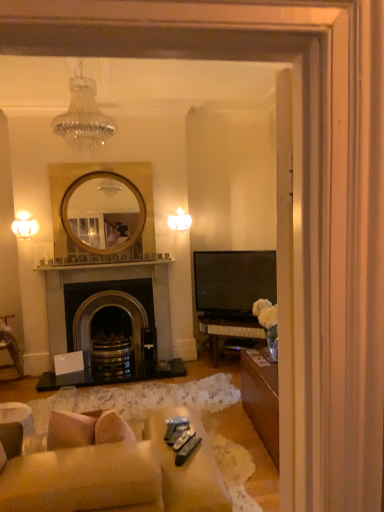
This screenshot has height=512, width=384. Describe the element at coordinates (83, 116) in the screenshot. I see `clear glass chandelier at upper center, acting as the 3th lamp starting from the back` at that location.

What are the coordinates of `metallic silver remote control at lower center, placed as the second remote control when sorted from front to back` in the screenshot? It's located at (183, 439).

The width and height of the screenshot is (384, 512). In order to click on dark gray stone fireplace at center in this screenshot , I will do `click(103, 307)`.

Find the location of a particular element. black plastic remote control at lower center, the 3th remote control from the front is located at coordinates (175, 432).

What is the approximate height of metallic gray remote control at lower center, the 3th remote control from the back?

metallic gray remote control at lower center, the 3th remote control from the back, is 3.31 centimeters in height.

What do you see at coordinates (187, 450) in the screenshot?
I see `metallic gray remote control at lower center, the 1th remote control viewed from the front` at bounding box center [187, 450].

At what (x,y) coordinates should I click in order to perform the action: click on clear glass chandelier at upper center, marked as the 2th lamp in a right-to-left arrangement. Please return your answer as a coordinate pair (x, y). This screenshot has height=512, width=384. Looking at the image, I should click on (83, 116).

Is metallic silver remote control at lower center, positioned as the second remote control in back-to-front order, situated inside black plastic remote control at lower center, which is counted as the first remote control, starting from the back, or outside?

metallic silver remote control at lower center, positioned as the second remote control in back-to-front order, is located beyond the bounds of black plastic remote control at lower center, which is counted as the first remote control, starting from the back.

Visually, is metallic silver remote control at lower center, positioned as the second remote control in back-to-front order, positioned to the left or to the right of black plastic remote control at lower center, the 3th remote control from the front?

In the image, metallic silver remote control at lower center, positioned as the second remote control in back-to-front order, appears on the right side of black plastic remote control at lower center, the 3th remote control from the front.

Is point (192, 433) positioned after point (174, 437)?

That is True.

Considering the relative sizes of clear glass chandelier at upper center, which is counted as the 2th lamp, starting from the left, and metallic gray remote control at lower center, the 1th remote control viewed from the front, in the image provided, is clear glass chandelier at upper center, which is counted as the 2th lamp, starting from the left, thinner than metallic gray remote control at lower center, the 1th remote control viewed from the front,?

No, clear glass chandelier at upper center, which is counted as the 2th lamp, starting from the left, is not thinner than metallic gray remote control at lower center, the 1th remote control viewed from the front.

How far apart are clear glass chandelier at upper center, the first lamp in the top-to-bottom sequence, and metallic gray remote control at lower center, the 1th remote control viewed from the front?

They are 1.96 meters apart.

Considering the sizes of objects clear glass chandelier at upper center, the third lamp ordered from the bottom, and metallic gray remote control at lower center, the 1th remote control viewed from the front, in the image provided, who is taller, clear glass chandelier at upper center, the third lamp ordered from the bottom, or metallic gray remote control at lower center, the 1th remote control viewed from the front,?

With more height is clear glass chandelier at upper center, the third lamp ordered from the bottom.

Which object is positioned more to the left, clear glass chandelier at upper center, which is counted as the 2th lamp, starting from the left, or metallic gray remote control at lower center, the 1th remote control viewed from the front?

clear glass chandelier at upper center, which is counted as the 2th lamp, starting from the left, is more to the left.

Does metallic gray remote control at lower center, the 3th remote control from the back, lie behind dark gray stone fireplace at center?

No, the depth of metallic gray remote control at lower center, the 3th remote control from the back, is less than that of dark gray stone fireplace at center.

Looking at the image, does metallic gray remote control at lower center, the 1th remote control viewed from the front, seem bigger or smaller compared to dark gray stone fireplace at center?

In the image, metallic gray remote control at lower center, the 1th remote control viewed from the front, appears to be smaller than dark gray stone fireplace at center.

From the image's perspective, is metallic gray remote control at lower center, the 3th remote control from the back, on dark gray stone fireplace at center?

No.

What's the angular difference between metallic gray remote control at lower center, the 3th remote control from the back, and dark gray stone fireplace at center's facing directions?

metallic gray remote control at lower center, the 3th remote control from the back, and dark gray stone fireplace at center are facing 143 degrees away from each other.

Is clear glass chandelier at upper center, marked as the 2th lamp in a right-to-left arrangement, oriented away from matte white sconce at left, placed as the second lamp when sorted from back to front?

clear glass chandelier at upper center, marked as the 2th lamp in a right-to-left arrangement, does not have its back to matte white sconce at left, placed as the second lamp when sorted from back to front.

Considering the sizes of objects clear glass chandelier at upper center, placed as the first lamp when sorted from front to back, and matte white sconce at left, arranged as the 1th lamp when viewed from the left, in the image provided, who is wider, clear glass chandelier at upper center, placed as the first lamp when sorted from front to back, or matte white sconce at left, arranged as the 1th lamp when viewed from the left,?

clear glass chandelier at upper center, placed as the first lamp when sorted from front to back.

From the image's perspective, who appears lower, clear glass chandelier at upper center, marked as the 2th lamp in a right-to-left arrangement, or matte white sconce at left, arranged as the 1th lamp when viewed from the left?

From the image's view, matte white sconce at left, arranged as the 1th lamp when viewed from the left, is below.

Can you confirm if clear glass chandelier at upper center, marked as the 2th lamp in a right-to-left arrangement, is positioned to the left of matte white sconce at left, marked as the 1th lamp in a bottom-to-top arrangement?

No, clear glass chandelier at upper center, marked as the 2th lamp in a right-to-left arrangement, is not to the left of matte white sconce at left, marked as the 1th lamp in a bottom-to-top arrangement.

Is matte white lampshade at upper center, positioned as the third lamp in left-to-right order, facing towards metallic silver remote control at lower center, placed as the second remote control when sorted from front to back?

Yes, matte white lampshade at upper center, positioned as the third lamp in left-to-right order, is turned towards metallic silver remote control at lower center, placed as the second remote control when sorted from front to back.

Consider the image. What's the angular difference between matte white lampshade at upper center, which is the second lamp in top-to-bottom order, and metallic silver remote control at lower center, placed as the second remote control when sorted from front to back,'s facing directions?

144 degrees.

Would you say matte white lampshade at upper center, the first lamp viewed from the back, is a long distance from metallic silver remote control at lower center, placed as the second remote control when sorted from front to back?

Yes, matte white lampshade at upper center, the first lamp viewed from the back, and metallic silver remote control at lower center, placed as the second remote control when sorted from front to back, are quite far apart.

Measure the distance between matte white lampshade at upper center, the first lamp viewed from the back, and metallic silver remote control at lower center, placed as the second remote control when sorted from front to back.

They are 2.94 meters apart.

Between point (180, 448) and point (184, 477), which one is positioned behind?

Positioned behind is point (180, 448).

From a real-world perspective, does metallic silver remote control at lower center, placed as the second remote control when sorted from front to back, stand above beige fabric couch at lower left?

Correct, in the physical world, metallic silver remote control at lower center, placed as the second remote control when sorted from front to back, is higher than beige fabric couch at lower left.

Between metallic silver remote control at lower center, positioned as the second remote control in back-to-front order, and beige fabric couch at lower left, which one has more height?

With more height is beige fabric couch at lower left.

In the scene shown: What's the angular difference between metallic silver remote control at lower center, placed as the second remote control when sorted from front to back, and beige fabric couch at lower left's facing directions?

There is a 35.9-degree angle between the facing directions of metallic silver remote control at lower center, placed as the second remote control when sorted from front to back, and beige fabric couch at lower left.

Considering the positions of objects beige fabric couch at lower left and metallic silver remote control at lower center, positioned as the second remote control in back-to-front order, in the image provided, who is in front, beige fabric couch at lower left or metallic silver remote control at lower center, positioned as the second remote control in back-to-front order,?

beige fabric couch at lower left.

Which of these two, beige fabric couch at lower left or metallic silver remote control at lower center, positioned as the second remote control in back-to-front order, is smaller?

Smaller between the two is metallic silver remote control at lower center, positioned as the second remote control in back-to-front order.

Which is more to the left, beige fabric couch at lower left or metallic silver remote control at lower center, positioned as the second remote control in back-to-front order?

From the viewer's perspective, beige fabric couch at lower left appears more on the left side.

Locate an element on the screen. This screenshot has height=512, width=384. remote control to the left of metallic silver remote control at lower center, placed as the second remote control when sorted from front to back is located at coordinates (175, 432).

Where is `the 3rd lamp located above the metallic gray remote control at lower center, the 1th remote control viewed from the front (from a real-world perspective)`? the 3rd lamp located above the metallic gray remote control at lower center, the 1th remote control viewed from the front (from a real-world perspective) is located at coordinates (83, 116).

Considering their positions, is metallic silver remote control at lower center, positioned as the second remote control in back-to-front order, positioned further to dark gray stone fireplace at center than clear glass chandelier at upper center, placed as the first lamp when sorted from front to back?

metallic silver remote control at lower center, positioned as the second remote control in back-to-front order, is positioned further to the anchor dark gray stone fireplace at center.

Which object lies further to the anchor point beige fabric couch at lower left, clear glass chandelier at upper center, the third lamp ordered from the bottom, or dark gray stone fireplace at center?

dark gray stone fireplace at center.

From the image, which object appears to be farther from beige fabric couch at lower left, metallic gray remote control at lower center, the 1th remote control viewed from the front, or matte white sconce at left, the second lamp positioned from the front?

The object further to beige fabric couch at lower left is matte white sconce at left, the second lamp positioned from the front.

Based on their spatial positions, is black plastic remote control at lower center, the 3th remote control from the front, or metallic gray remote control at lower center, the 1th remote control viewed from the front, closer to metallic silver remote control at lower center, placed as the second remote control when sorted from front to back?

Based on the image, metallic gray remote control at lower center, the 1th remote control viewed from the front, appears to be nearer to metallic silver remote control at lower center, placed as the second remote control when sorted from front to back.

Considering their positions, is matte white sconce at left, the second lamp positioned from the front, positioned further to clear glass chandelier at upper center, acting as the 3th lamp starting from the back, than matte white lampshade at upper center, the first lamp viewed from the back?

matte white lampshade at upper center, the first lamp viewed from the back.

Looking at the image, which one is located further to beige fabric couch at lower left, dark gray stone fireplace at center or clear glass chandelier at upper center, which is counted as the 2th lamp, starting from the left?

dark gray stone fireplace at center.

Consider the image. Based on their spatial positions, is black plastic remote control at lower center, the 3th remote control from the front, or clear glass chandelier at upper center, the first lamp in the top-to-bottom sequence, closer to metallic gray remote control at lower center, the 1th remote control viewed from the front?

black plastic remote control at lower center, the 3th remote control from the front, lies closer to metallic gray remote control at lower center, the 1th remote control viewed from the front, than the other object.

Looking at the image, which one is located further to clear glass chandelier at upper center, placed as the first lamp when sorted from front to back, matte white sconce at left, marked as the 1th lamp in a bottom-to-top arrangement, or metallic silver remote control at lower center, placed as the second remote control when sorted from front to back?

matte white sconce at left, marked as the 1th lamp in a bottom-to-top arrangement.

In order to click on lamp located between metallic gray remote control at lower center, the 3th remote control from the back, and matte white sconce at left, marked as the 1th lamp in a bottom-to-top arrangement, in the depth direction in this screenshot , I will do `click(83, 116)`.

Find the location of a particular element. The height and width of the screenshot is (512, 384). remote control positioned between metallic silver remote control at lower center, positioned as the second remote control in back-to-front order, and dark gray stone fireplace at center from near to far is located at coordinates (175, 432).

Where is `lamp positioned between clear glass chandelier at upper center, the third lamp ordered from the bottom, and matte white lampshade at upper center, positioned as the third lamp in left-to-right order, from near to far`? The image size is (384, 512). lamp positioned between clear glass chandelier at upper center, the third lamp ordered from the bottom, and matte white lampshade at upper center, positioned as the third lamp in left-to-right order, from near to far is located at coordinates tap(24, 226).

At what (x,y) coordinates should I click in order to perform the action: click on fireplace located between clear glass chandelier at upper center, the first lamp in the top-to-bottom sequence, and matte white lampshade at upper center, the first lamp viewed from the back, in the depth direction. Please return your answer as a coordinate pair (x, y). The image size is (384, 512). Looking at the image, I should click on (103, 307).